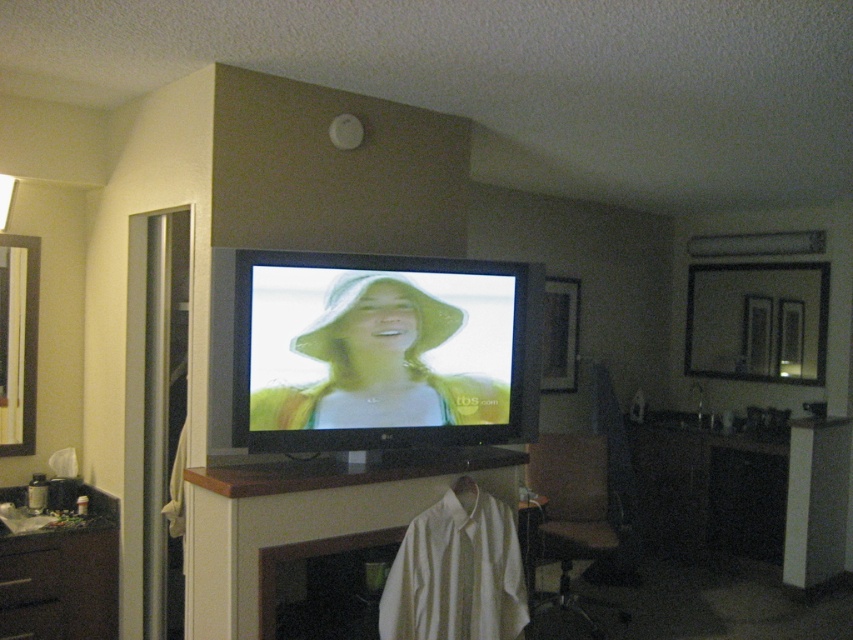
Question: Among these points, which one is nearest to the camera?

Choices:
 (A) (544, 452)
 (B) (357, 401)
 (C) (187, 586)

Answer: (C)

Question: Which is farther from the dark brown wood dresser at lower left?

Choices:
 (A) matte yellow hat at center
 (B) wooden seat at lower right
 (C) white fabric shirt at center

Answer: (B)

Question: Is matte yellow hat at center to the left of wooden seat at lower right from the viewer's perspective?

Choices:
 (A) yes
 (B) no

Answer: (A)

Question: Is matte yellow hat at center smaller than wooden seat at lower right?

Choices:
 (A) no
 (B) yes

Answer: (B)

Question: Considering the relative positions of white fabric shirt at center and matte yellow hat at center in the image provided, where is white fabric shirt at center located with respect to matte yellow hat at center?

Choices:
 (A) below
 (B) above

Answer: (A)

Question: Which of the following is the farthest from the observer?

Choices:
 (A) (341, 330)
 (B) (196, 630)

Answer: (A)